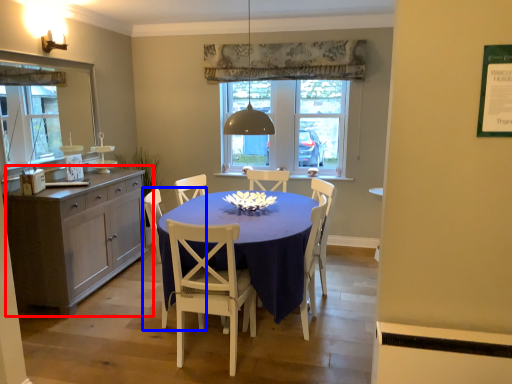
Question: Which point is closer to the camera, cabinetry (highlighted by a red box) or chair (highlighted by a blue box)?

Choices:
 (A) cabinetry
 (B) chair

Answer: (B)